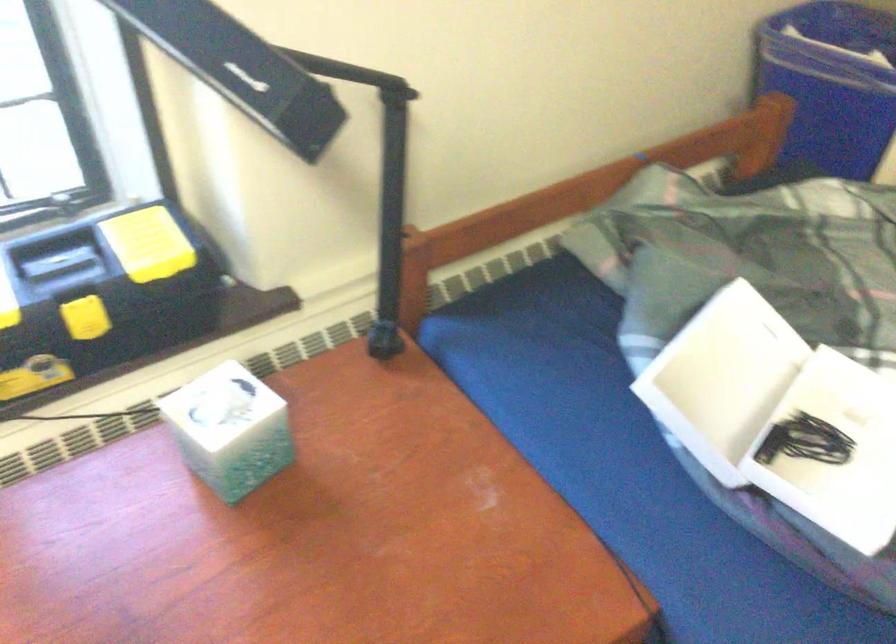
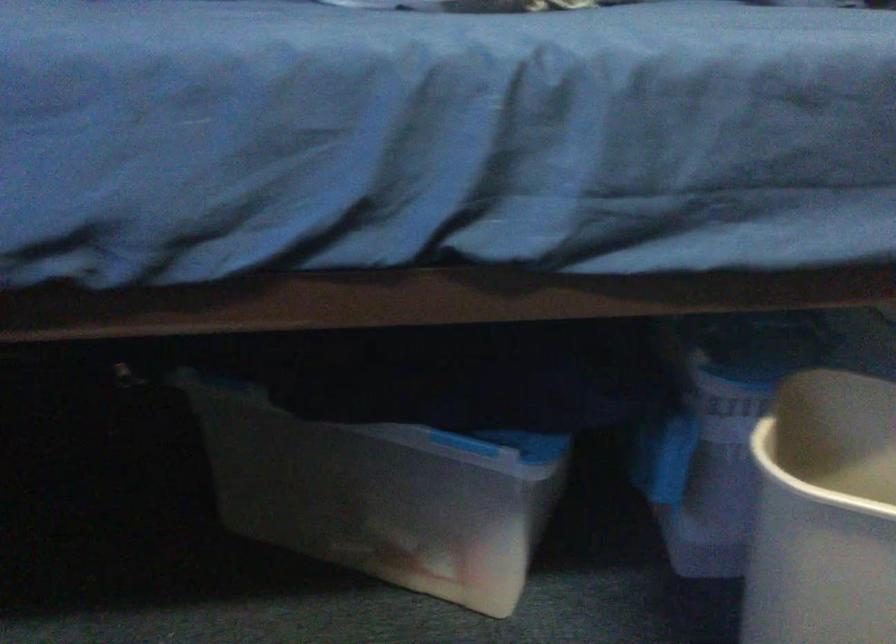
Question: The camera is either moving clockwise (left) or counter-clockwise (right) around the object. The first image is from the beginning of the video and the second image is from the end. Is the camera moving left or right when shooting the video?

Choices:
 (A) Left
 (B) Right

Answer: (A)